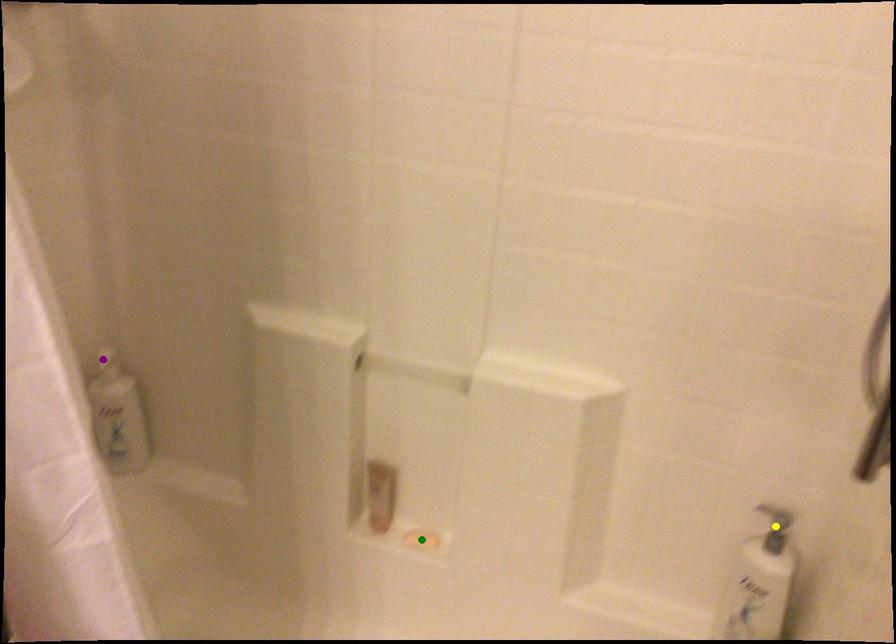
Order these from farthest to nearest:
yellow point | green point | purple point

1. purple point
2. green point
3. yellow point